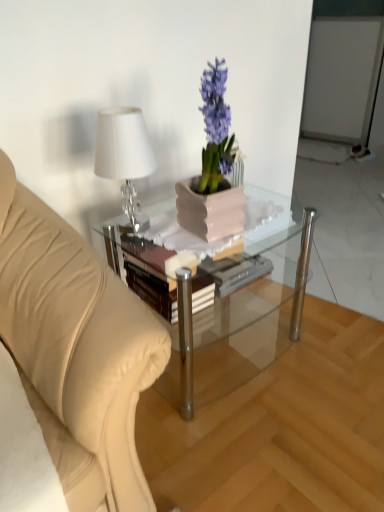
Question: Is hardcover book at center at the left side of matte pink pot at center?

Choices:
 (A) yes
 (B) no

Answer: (A)

Question: Is matte pink pot at center at the back of hardcover book at center?

Choices:
 (A) yes
 (B) no

Answer: (B)

Question: From the image's perspective, is hardcover book at center beneath matte pink pot at center?

Choices:
 (A) no
 (B) yes

Answer: (B)

Question: Does hardcover book at center have a lesser height compared to matte pink pot at center?

Choices:
 (A) yes
 (B) no

Answer: (A)

Question: Can you confirm if hardcover book at center is positioned to the right of matte pink pot at center?

Choices:
 (A) no
 (B) yes

Answer: (A)

Question: Is hardcover book at center bigger than matte pink pot at center?

Choices:
 (A) yes
 (B) no

Answer: (B)

Question: From a real-world perspective, does clear glass coffee table at center sit lower than matte pink pot at center?

Choices:
 (A) yes
 (B) no

Answer: (A)

Question: Can you confirm if clear glass coffee table at center is wider than matte pink pot at center?

Choices:
 (A) no
 (B) yes

Answer: (B)

Question: Would you say clear glass coffee table at center is a long distance from matte pink pot at center?

Choices:
 (A) yes
 (B) no

Answer: (B)

Question: Does clear glass coffee table at center have a larger size compared to matte pink pot at center?

Choices:
 (A) no
 (B) yes

Answer: (B)

Question: Is clear glass coffee table at center surrounding matte pink pot at center?

Choices:
 (A) yes
 (B) no

Answer: (B)

Question: Is the depth of clear glass coffee table at center greater than that of matte pink pot at center?

Choices:
 (A) no
 (B) yes

Answer: (B)

Question: Does matte pink pot at center have a lesser height compared to hardcover book at center?

Choices:
 (A) no
 (B) yes

Answer: (A)